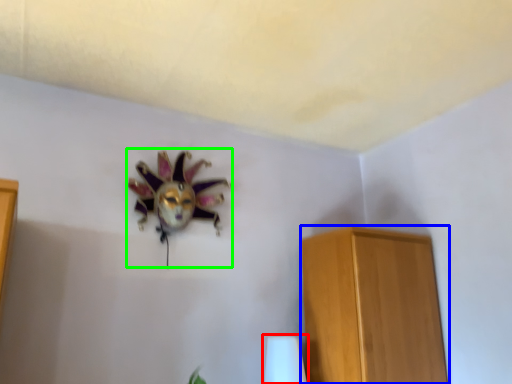
Question: Which object is positioned farthest from table lamp (highlighted by a red box)? Select from furniture (highlighted by a blue box) and animal (highlighted by a green box).

Choices:
 (A) furniture
 (B) animal

Answer: (B)